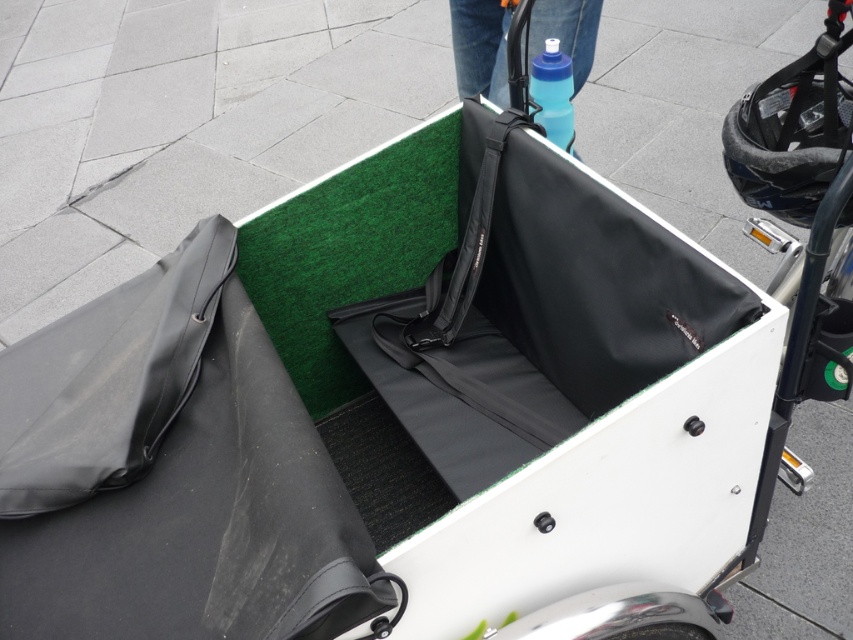
Question: Does black matte bag at lower left appear under blue matte water bottle at upper center?

Choices:
 (A) no
 (B) yes

Answer: (B)

Question: Which point appears closest to the camera in this image?

Choices:
 (A) (706, 637)
 (B) (550, 96)

Answer: (A)

Question: Is transparent plastic bottle at upper center to the right of metallic silver wheel at lower center from the viewer's perspective?

Choices:
 (A) yes
 (B) no

Answer: (B)

Question: From the image, what is the correct spatial relationship of blue matte water bottle at upper center in relation to black fabric strap at center?

Choices:
 (A) below
 (B) above

Answer: (B)

Question: Which of the following is the farthest from the observer?

Choices:
 (A) black matte bag at lower left
 (B) black fabric strap at center
 (C) transparent plastic bottle at upper center

Answer: (B)

Question: Which point is closer to the camera taking this photo?

Choices:
 (A) (689, 628)
 (B) (566, 61)
 (C) (477, 179)

Answer: (A)